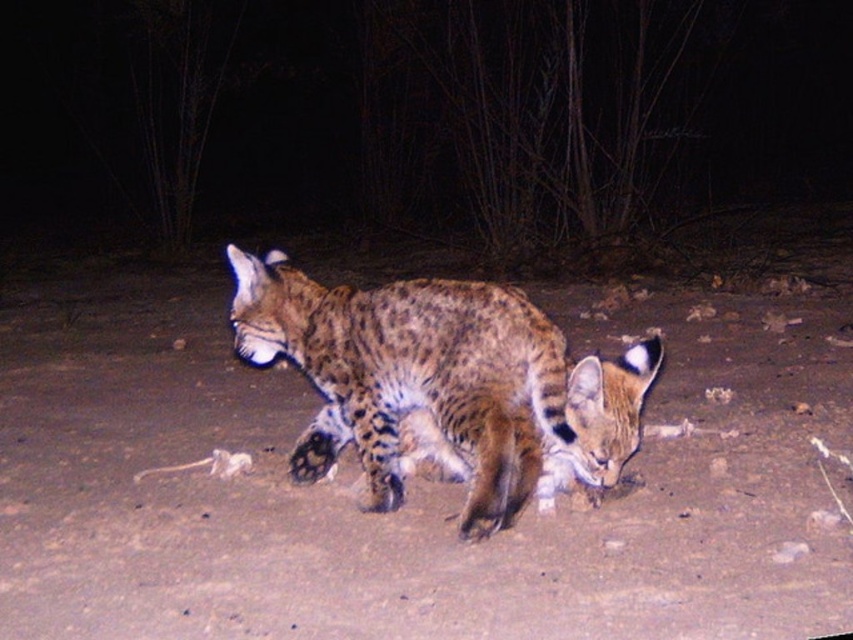
Question: Does brown sandy dirt at center appear under spotted fur cat at center?

Choices:
 (A) yes
 (B) no

Answer: (A)

Question: Does brown sandy dirt at center appear on the right side of spotted fur cat at center?

Choices:
 (A) yes
 (B) no

Answer: (B)

Question: Which of the following is the farthest from the observer?

Choices:
 (A) brown sandy dirt at center
 (B) spotted fur cat at center

Answer: (B)

Question: Among these objects, which one is nearest to the camera?

Choices:
 (A) spotted fur cat at center
 (B) brown sandy dirt at center

Answer: (B)

Question: Is brown sandy dirt at center behind spotted fur cat at center?

Choices:
 (A) no
 (B) yes

Answer: (A)

Question: Which of the following is the farthest from the observer?

Choices:
 (A) (518, 433)
 (B) (824, 440)

Answer: (B)